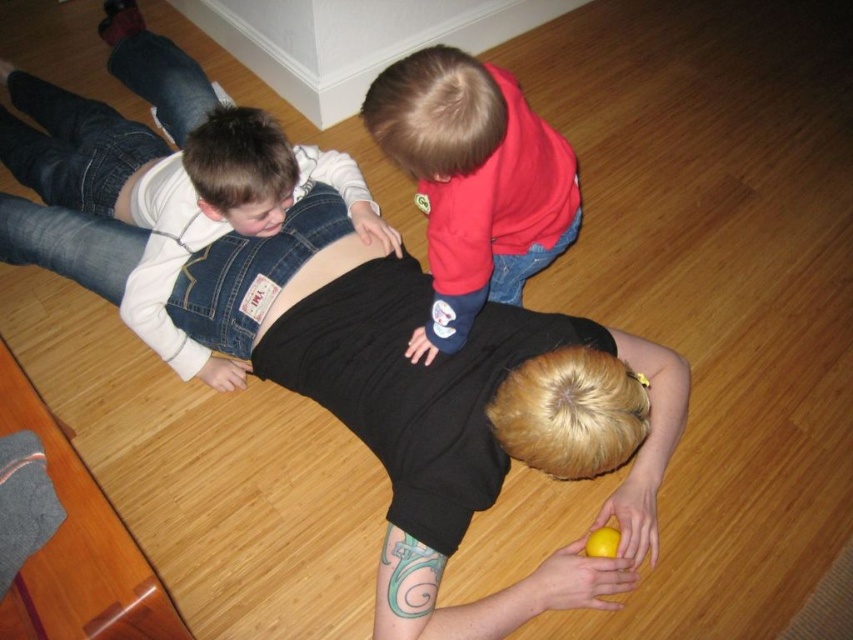
Question: Which point is farther from the camera taking this photo?

Choices:
 (A) (392, 65)
 (B) (207, 173)
 (C) (331, 253)

Answer: (C)

Question: Can you confirm if denim overalls at upper left is positioned below red fleece sweater at upper center?

Choices:
 (A) no
 (B) yes

Answer: (A)

Question: Which object is farther from the camera taking this photo?

Choices:
 (A) denim overalls at upper left
 (B) denim at center

Answer: (B)

Question: Where is denim overalls at upper left located in relation to denim at center in the image?

Choices:
 (A) above
 (B) below

Answer: (A)

Question: Is denim overalls at upper left below red fleece sweater at upper center?

Choices:
 (A) yes
 (B) no

Answer: (B)

Question: Which object is positioned closest to the denim overalls at upper left?

Choices:
 (A) red fleece sweater at upper center
 (B) denim at center

Answer: (B)